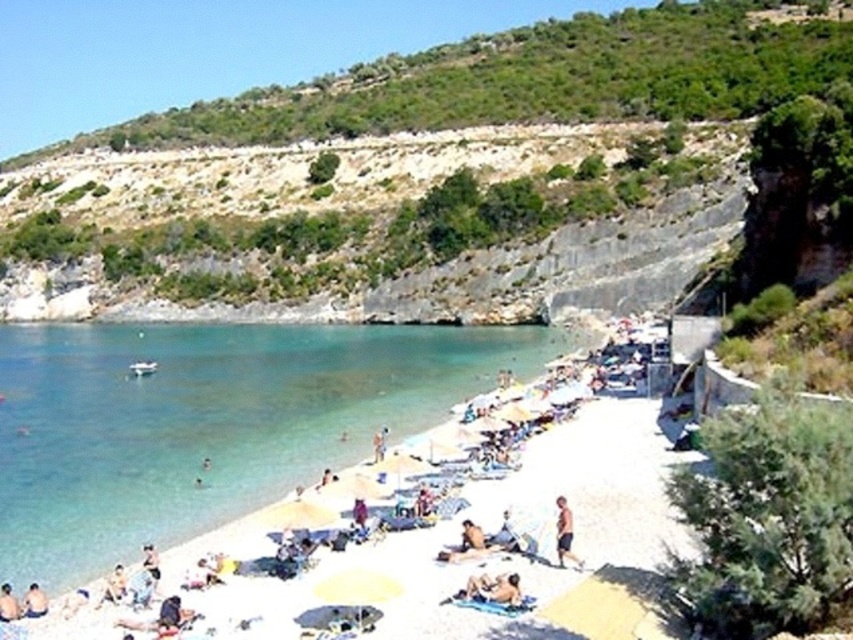
Question: Can you confirm if green leafy hillside at upper center is positioned to the left of beige fabric towel at lower left?

Choices:
 (A) no
 (B) yes

Answer: (A)

Question: Which of these objects is positioned farthest from the green leafy hillside at upper center?

Choices:
 (A) tan skin person at lower center
 (B) light brown skin at lower left

Answer: (B)

Question: From the image, what is the correct spatial relationship of green leafy hillside at upper center in relation to light brown skin at lower left?

Choices:
 (A) right
 (B) left

Answer: (A)

Question: Is green leafy hillside at upper center smaller than tan skin man at center?

Choices:
 (A) yes
 (B) no

Answer: (B)

Question: Which point is closer to the camera?

Choices:
 (A) tan skin man at center
 (B) green leafy hillside at upper center
 (C) beige fabric towel at lower left

Answer: (C)

Question: Which point appears closest to the camera in this image?

Choices:
 (A) (741, 74)
 (B) (560, 536)
 (C) (473, 529)
 (D) (32, 589)

Answer: (D)